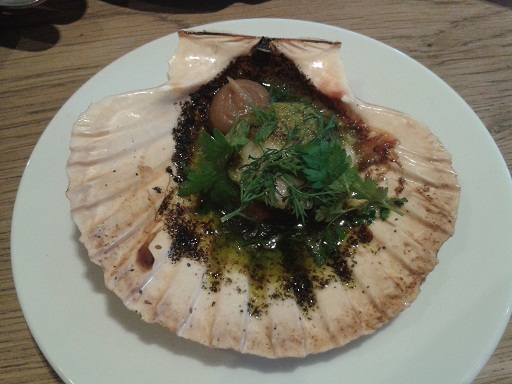
Identify the location of brown wooden table top. (37, 107).